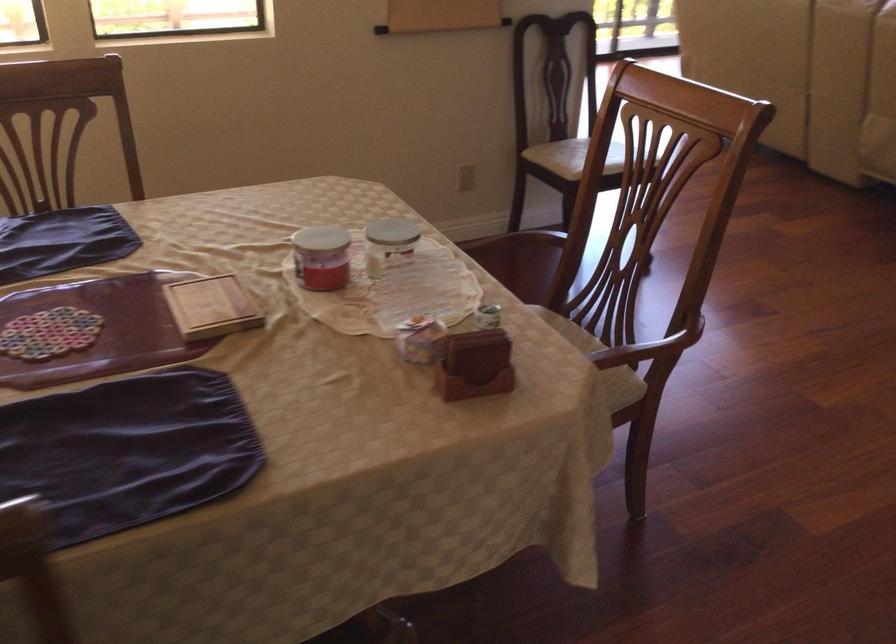
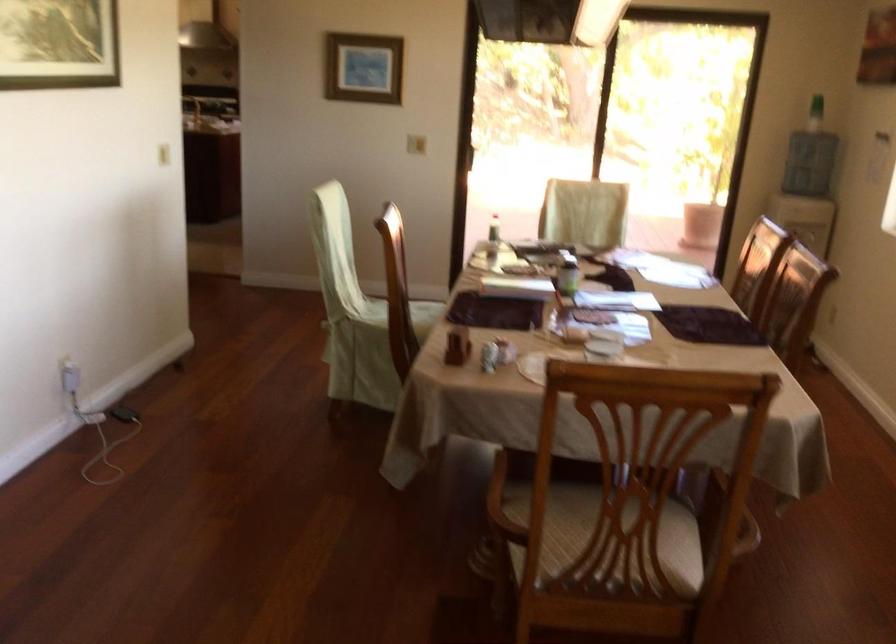
In the second image, find the point that corresponds to point 584,200 in the first image.

(722, 509)